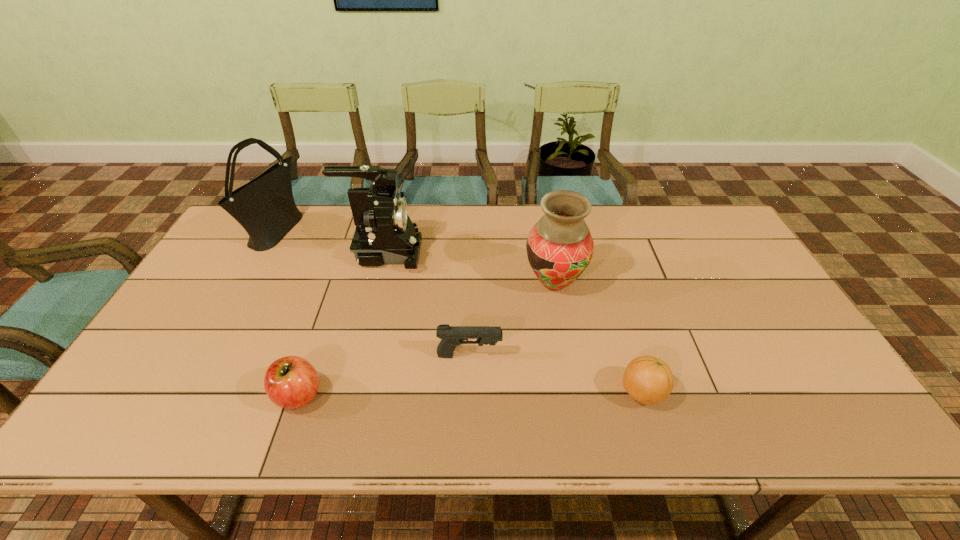
This screenshot has height=540, width=960. Identify the location of free space that is in between the third nearest object and the vase. (512, 319).

This screenshot has width=960, height=540. I want to click on free point between the apple and the rightmost object, so click(x=470, y=394).

Find the location of `free space between the fourth farthest object and the camcorder`. free space between the fourth farthest object and the camcorder is located at coordinates (426, 304).

At what (x,y) coordinates should I click in order to perform the action: click on empty space that is in between the leftmost object and the apple. Please return your answer as a coordinate pair (x, y). The image size is (960, 540). Looking at the image, I should click on (287, 313).

Identify the location of object that can be found as the third closest to the camcorder. click(559, 247).

Locate an element on the screen. the closest object relative to the camcorder is located at coordinates pos(265,207).

This screenshot has width=960, height=540. Identify the location of vacant space that satisfies the following two spatial constraints: 1. on the lens mount of the camcorder; 2. on the left side of the vase. (376, 283).

Find the location of `vacant space that satisfies the following two spatial constraints: 1. on the front side of the apple; 2. on the right side of the leftmost object`. vacant space that satisfies the following two spatial constraints: 1. on the front side of the apple; 2. on the right side of the leftmost object is located at coordinates (184, 395).

You are a GUI agent. You are given a task and a screenshot of the screen. Output one action in this format:
    pyautogui.click(x=<x>, y=<y>)
    Task: Click on the vacant region that satisfies the following two spatial constraints: 1. at the barrel of the orange; 2. on the left side of the fourth object from left to right
    
    Given the screenshot: What is the action you would take?
    pyautogui.click(x=468, y=393)

This screenshot has height=540, width=960. In order to click on blank space that satisfies the following two spatial constraints: 1. on the back side of the fifth object from left to right; 2. on the right side of the apple in this screenshot , I will do `click(337, 283)`.